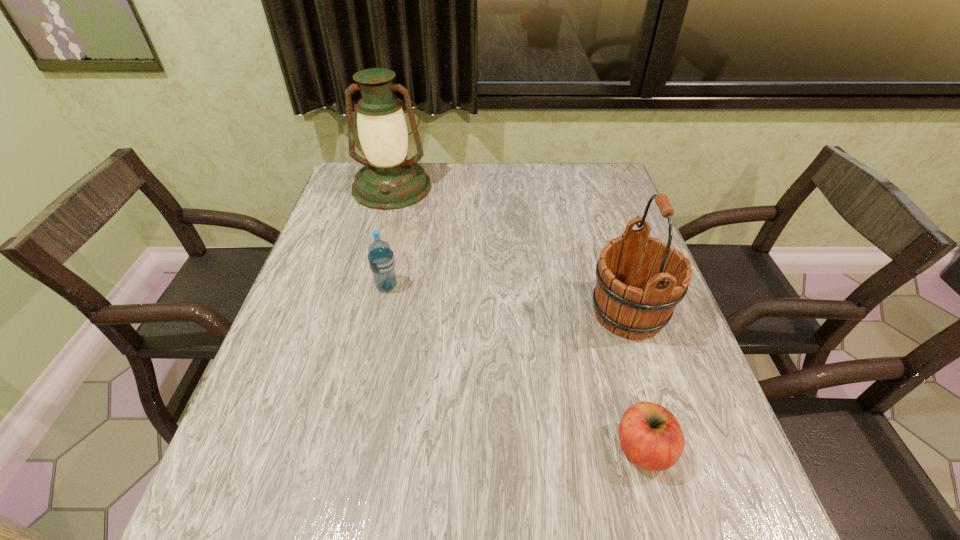
I want to click on free location that satisfies the following two spatial constraints: 1. on the back side of the nearest object; 2. on the right side of the wine bucket, so click(x=606, y=313).

Where is `vacant region that satisfies the following two spatial constraints: 1. with the light compartment facing forward on the shortest object; 2. on the right side of the lantern`? This screenshot has width=960, height=540. vacant region that satisfies the following two spatial constraints: 1. with the light compartment facing forward on the shortest object; 2. on the right side of the lantern is located at coordinates (324, 449).

The width and height of the screenshot is (960, 540). I want to click on vacant area in the image that satisfies the following two spatial constraints: 1. with the light compartment facing forward on the second shortest object; 2. on the right side of the lantern, so click(x=366, y=286).